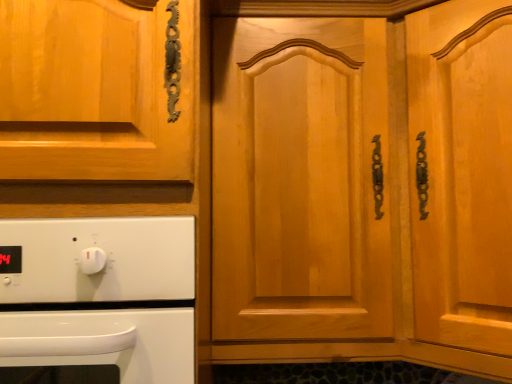
Locate an element on the screen. light brown wood door at center is located at coordinates (300, 179).

Describe the element at coordinates (300, 179) in the screenshot. The height and width of the screenshot is (384, 512). I see `light brown wood door at center` at that location.

Describe the element at coordinates (98, 298) in the screenshot. Image resolution: width=512 pixels, height=384 pixels. I see `white glossy oven at lower left` at that location.

What is the approximate width of white glossy oven at lower left?

The width of white glossy oven at lower left is 54.60 centimeters.

Identify the location of white glossy oven at lower left. The image size is (512, 384). click(98, 298).

This screenshot has height=384, width=512. I want to click on light brown wood door at center, so click(300, 179).

Is light brown wood door at center to the left or to the right of white glossy oven at lower left in the image?

In the image, light brown wood door at center appears on the right side of white glossy oven at lower left.

In the image, is light brown wood door at center positioned in front of or behind white glossy oven at lower left?

light brown wood door at center is behind white glossy oven at lower left.

Which is behind, point (326, 85) or point (90, 365)?

The point (326, 85) is more distant.

From the image's perspective, does light brown wood door at center appear lower than white glossy oven at lower left?

No.

From a real-world perspective, which object stands above the other?

In real-world perspective, light brown wood door at center is above.

Which object is thinner, light brown wood door at center or white glossy oven at lower left?

Thinner between the two is white glossy oven at lower left.

Considering the relative sizes of light brown wood door at center and white glossy oven at lower left in the image provided, is light brown wood door at center shorter than white glossy oven at lower left?

Incorrect, the height of light brown wood door at center does not fall short of that of white glossy oven at lower left.

Considering the relative sizes of light brown wood door at center and white glossy oven at lower left in the image provided, is light brown wood door at center smaller than white glossy oven at lower left?

No.

Is light brown wood door at center positioned beyond the bounds of white glossy oven at lower left?

That's correct, light brown wood door at center is outside of white glossy oven at lower left.

Is light brown wood door at center positioned far away from white glossy oven at lower left?

No.

Could you tell me if light brown wood door at center is facing white glossy oven at lower left?

No, light brown wood door at center is not turned towards white glossy oven at lower left.

In the scene shown: How many degrees apart are the facing directions of light brown wood door at center and white glossy oven at lower left?

The angular difference between light brown wood door at center and white glossy oven at lower left is 0.00137 degrees.

Image resolution: width=512 pixels, height=384 pixels. In order to click on home appliance to the left of light brown wood door at center in this screenshot , I will do `click(98, 298)`.

Which is more to the right, white glossy oven at lower left or light brown wood door at center?

Positioned to the right is light brown wood door at center.

Is white glossy oven at lower left positioned behind light brown wood door at center?

No, it is not.

Does point (128, 317) appear closer or farther from the camera than point (356, 132)?

Point (128, 317).

Looking at this image, from the image's perspective, is white glossy oven at lower left located beneath light brown wood door at center?

Yes.

From a real-world perspective, which object rests below the other?

white glossy oven at lower left, from a real-world perspective.

Is white glossy oven at lower left thinner than light brown wood door at center?

Yes.

Does white glossy oven at lower left have a greater height compared to light brown wood door at center?

Incorrect, the height of white glossy oven at lower left is not larger of that of light brown wood door at center.

Does white glossy oven at lower left have a larger size compared to light brown wood door at center?

Incorrect, white glossy oven at lower left is not larger than light brown wood door at center.

Can we say white glossy oven at lower left lies outside light brown wood door at center?

white glossy oven at lower left lies outside light brown wood door at center's area.

Consider the image. Is white glossy oven at lower left next to light brown wood door at center and touching it?

No, white glossy oven at lower left is not beside light brown wood door at center.

Is white glossy oven at lower left facing away from light brown wood door at center?

No, white glossy oven at lower left is not facing away from light brown wood door at center.

How many degrees apart are the facing directions of white glossy oven at lower left and light brown wood door at center?

0.00137 degrees separate the facing orientations of white glossy oven at lower left and light brown wood door at center.

In the image, there is a light brown wood door at center. Identify the location of home appliance below it (from a real-world perspective). The width and height of the screenshot is (512, 384). (98, 298).

In the image, there is a white glossy oven at lower left. Identify the location of door above it (from the image's perspective). (300, 179).

The width and height of the screenshot is (512, 384). What are the coordinates of `door behind the white glossy oven at lower left` in the screenshot? It's located at 300,179.